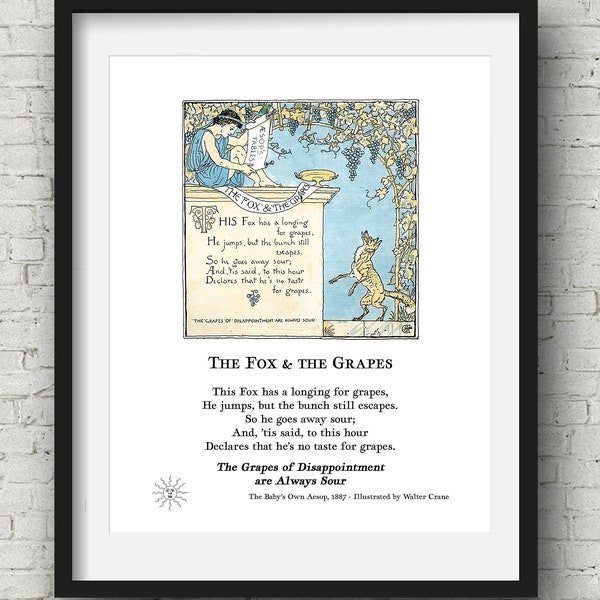
Where is `picture`? The width and height of the screenshot is (600, 600). picture is located at coordinates (351, 58).